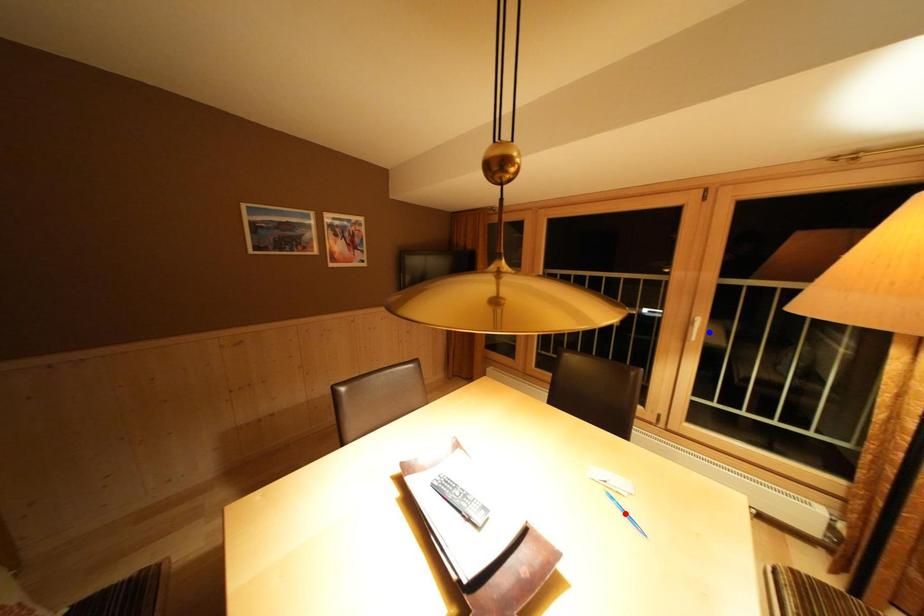
Question: Which of the two points in the image is closer to the camera?

Choices:
 (A) Blue point is closer.
 (B) Red point is closer.

Answer: (B)